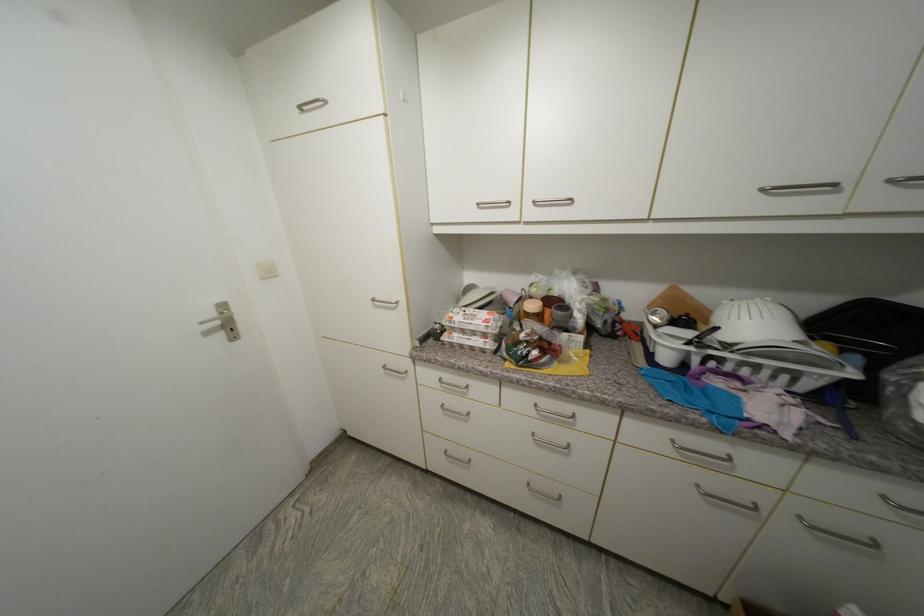
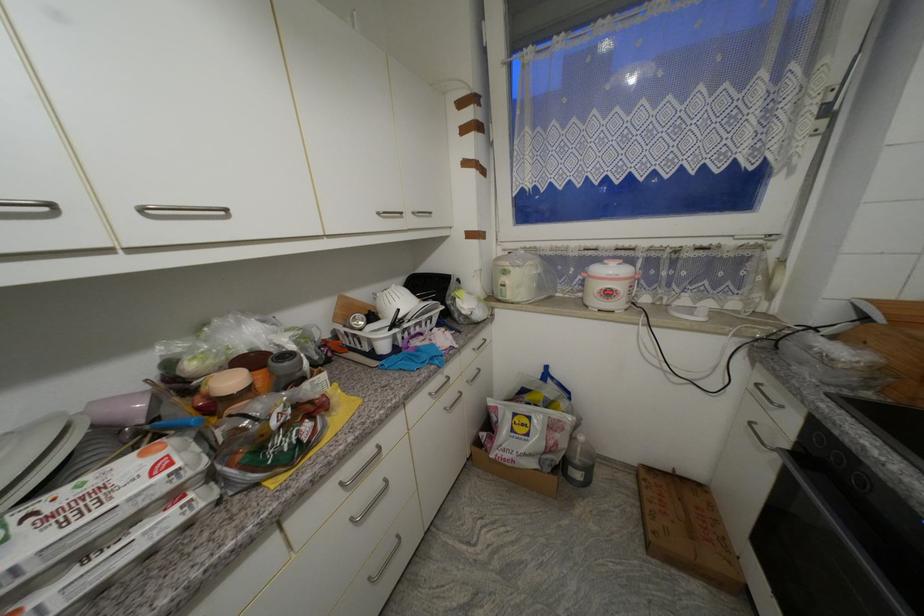
Locate, in the second image, the point that corresponds to (540,204) in the first image.

(149, 211)